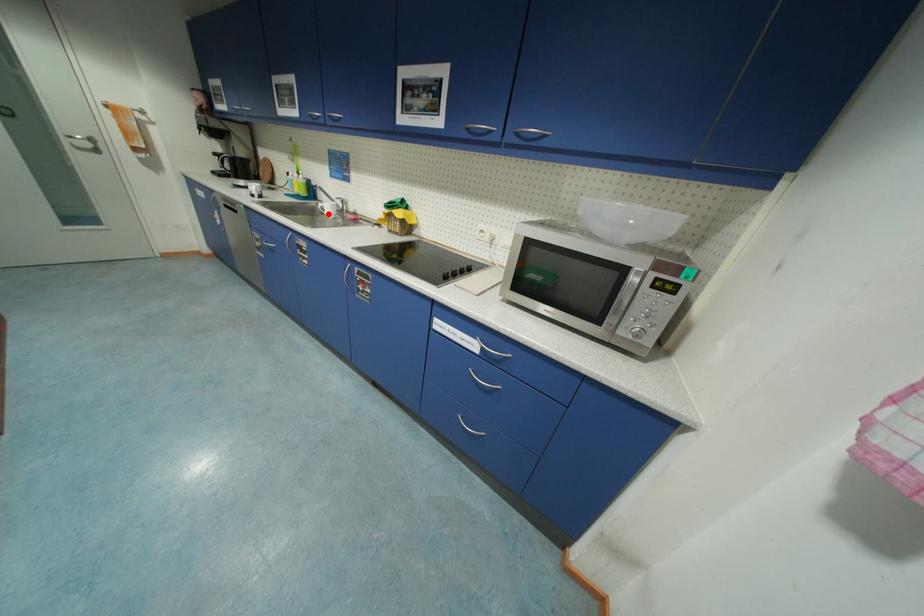
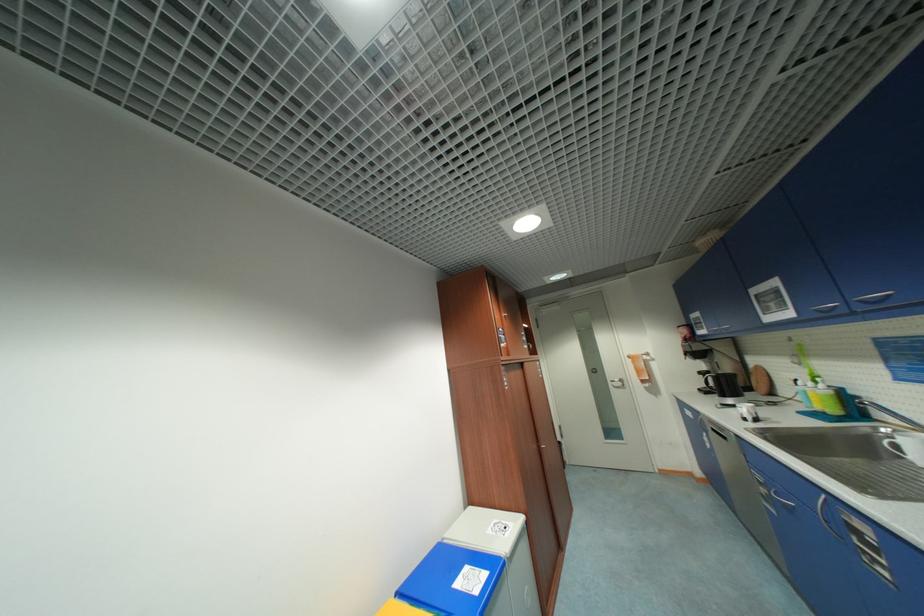
Find the pixel in the second image that matches the highlighted location in the first image.

(906, 458)